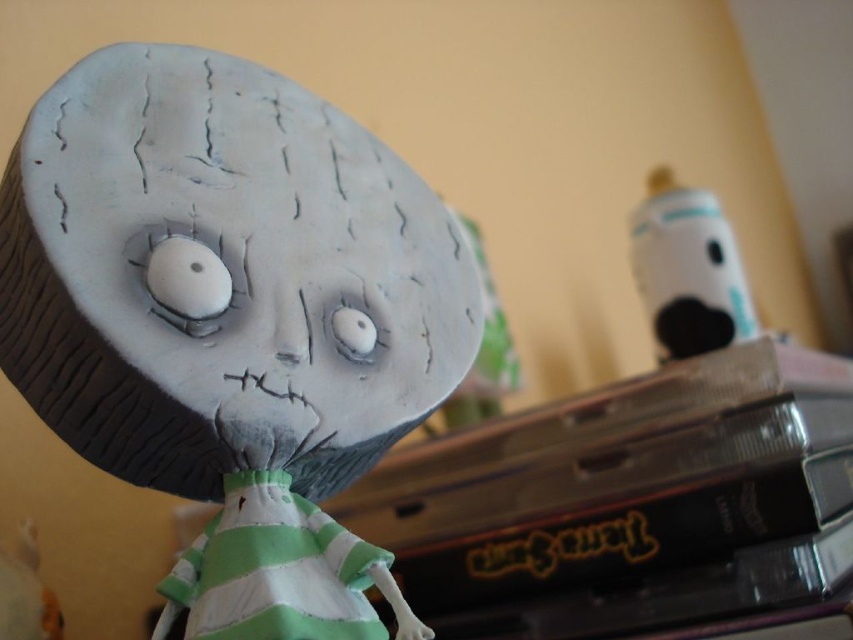
Question: In this image, where is matte clay doll at center located relative to white matte baby bottle at upper right?

Choices:
 (A) below
 (B) above

Answer: (A)

Question: Which point is farther from the camera taking this photo?

Choices:
 (A) (x=680, y=348)
 (B) (x=453, y=266)

Answer: (A)

Question: Is matte clay doll at center to the left of white matte baby bottle at upper right from the viewer's perspective?

Choices:
 (A) yes
 (B) no

Answer: (A)

Question: Does matte clay doll at center lie behind white matte baby bottle at upper right?

Choices:
 (A) yes
 (B) no

Answer: (B)

Question: Which object appears closest to the camera in this image?

Choices:
 (A) white matte baby bottle at upper right
 (B) matte clay doll at center

Answer: (B)

Question: Which of the following is the farthest from the observer?

Choices:
 (A) matte clay doll at center
 (B) white matte baby bottle at upper right

Answer: (B)